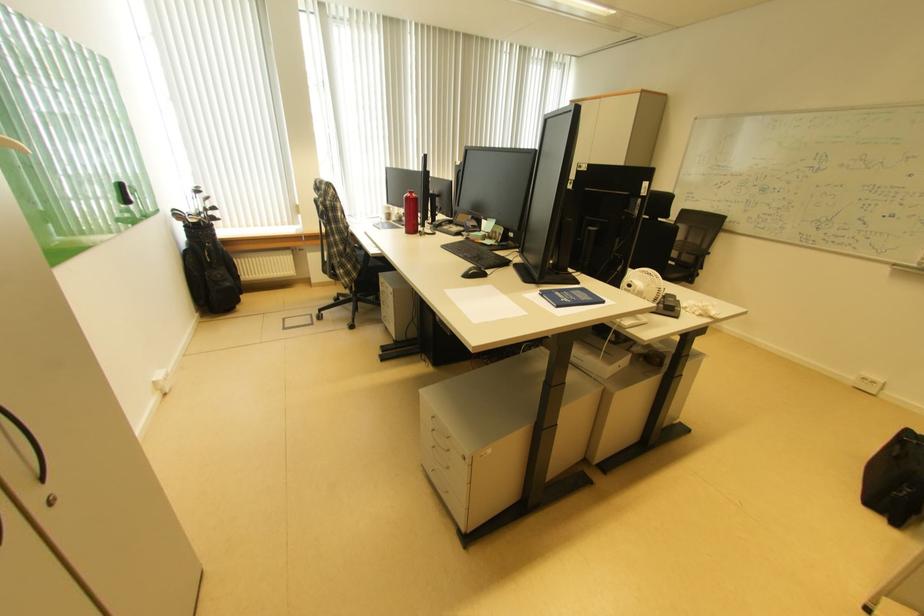
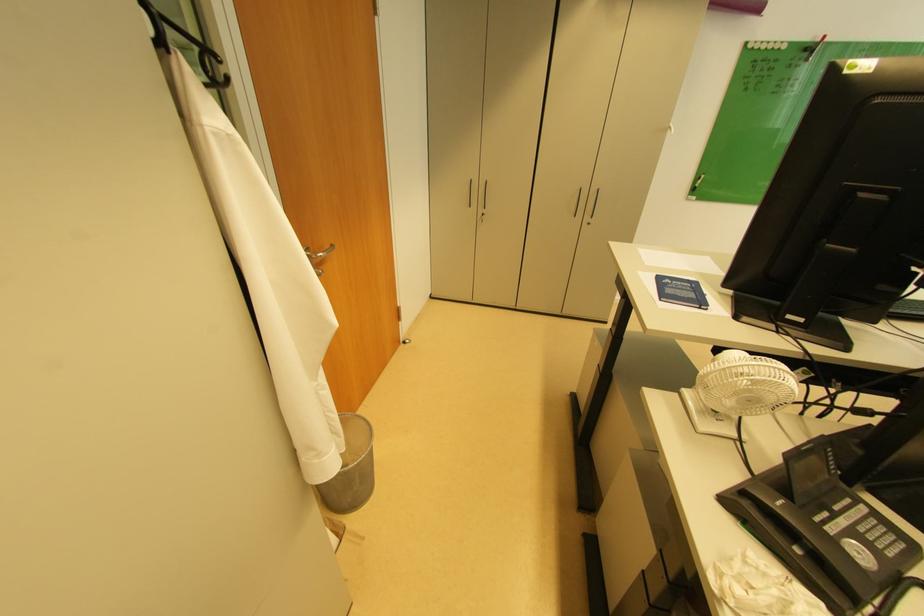
Find the pixel in the second image that matches [682,301] in the first image.

(786, 506)